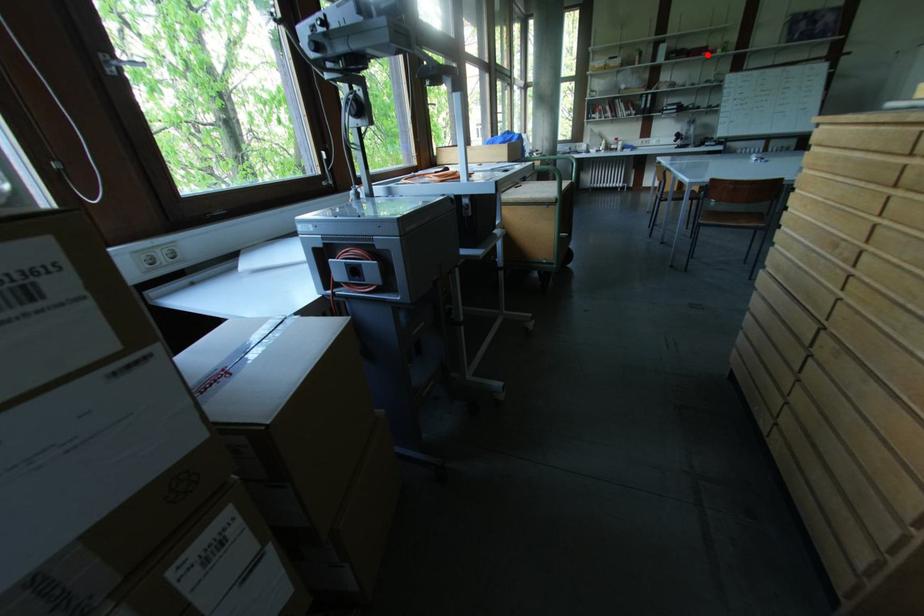
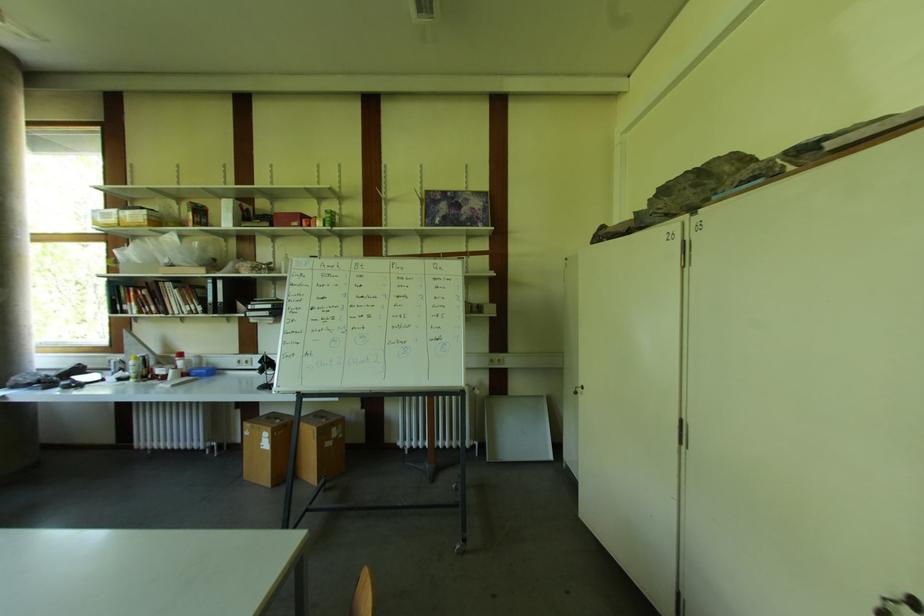
Find the pixel in the second image that matches the highlighted location in the first image.

(298, 225)